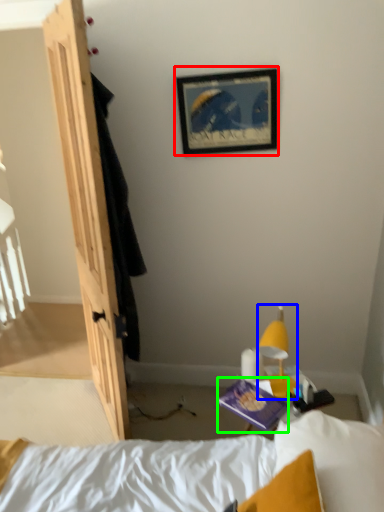
Question: Based on their relative distances, which object is nearer to picture frame (highlighted by a red box)? Choose from light fixture (highlighted by a blue box) and paperback book (highlighted by a green box).

Choices:
 (A) light fixture
 (B) paperback book

Answer: (A)